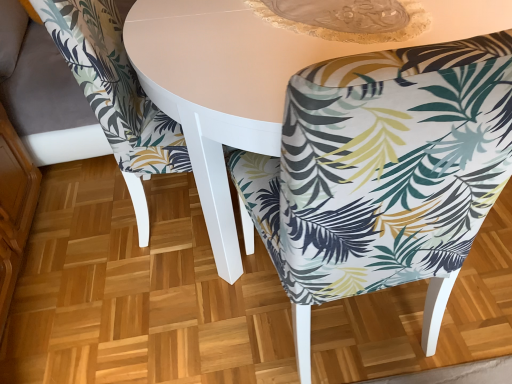
Where is `printed fabric chair at center, placed as the first chair when sorted from right to left`? printed fabric chair at center, placed as the first chair when sorted from right to left is located at coordinates (383, 167).

This screenshot has width=512, height=384. What are the coordinates of `printed fabric chair at center, arranged as the 1th chair when viewed from the left` in the screenshot? It's located at (116, 94).

Looking at this image, considering the relative sizes of printed fabric chair at center, which ranks as the 2th chair in left-to-right order, and white glossy table at center in the image provided, is printed fabric chair at center, which ranks as the 2th chair in left-to-right order, taller than white glossy table at center?

Yes, printed fabric chair at center, which ranks as the 2th chair in left-to-right order, is taller than white glossy table at center.

Is the depth of printed fabric chair at center, placed as the first chair when sorted from right to left, greater than that of white glossy table at center?

No, it is in front of white glossy table at center.

Between printed fabric chair at center, which ranks as the 2th chair in left-to-right order, and white glossy table at center, which one appears on the right side from the viewer's perspective?

printed fabric chair at center, which ranks as the 2th chair in left-to-right order, is more to the right.

Is point (445, 211) behind point (165, 3)?

No.

Looking at this image, are printed fabric chair at center, which ranks as the 2th chair in left-to-right order, and printed fabric chair at center, marked as the second chair in a right-to-left arrangement, located far from each other?

That's not correct — printed fabric chair at center, which ranks as the 2th chair in left-to-right order, is a little close to printed fabric chair at center, marked as the second chair in a right-to-left arrangement.

Between printed fabric chair at center, placed as the first chair when sorted from right to left, and printed fabric chair at center, marked as the second chair in a right-to-left arrangement, which one appears on the left side from the viewer's perspective?

From the viewer's perspective, printed fabric chair at center, marked as the second chair in a right-to-left arrangement, appears more on the left side.

Is printed fabric chair at center, marked as the second chair in a right-to-left arrangement, inside printed fabric chair at center, placed as the first chair when sorted from right to left?

No, printed fabric chair at center, placed as the first chair when sorted from right to left, does not contain printed fabric chair at center, marked as the second chair in a right-to-left arrangement.

From a real-world perspective, is white glossy table at center on printed fabric chair at center, marked as the second chair in a right-to-left arrangement?

No, from a real-world perspective, white glossy table at center is not over printed fabric chair at center, marked as the second chair in a right-to-left arrangement

Which is closer, (226, 101) or (114, 77)?

The point (226, 101) is closer.

Which is behind, white glossy table at center or printed fabric chair at center, arranged as the 1th chair when viewed from the left?

printed fabric chair at center, arranged as the 1th chair when viewed from the left, is behind.

From the image's perspective, would you say white glossy table at center is positioned over printed fabric chair at center, arranged as the 1th chair when viewed from the left?

No.

Can you confirm if printed fabric chair at center, arranged as the 1th chair when viewed from the left, is smaller than printed fabric chair at center, which ranks as the 2th chair in left-to-right order?

Actually, printed fabric chair at center, arranged as the 1th chair when viewed from the left, might be larger than printed fabric chair at center, which ranks as the 2th chair in left-to-right order.

Which of these two, printed fabric chair at center, marked as the second chair in a right-to-left arrangement, or printed fabric chair at center, which ranks as the 2th chair in left-to-right order, stands shorter?

Standing shorter between the two is printed fabric chair at center, marked as the second chair in a right-to-left arrangement.

Would you say printed fabric chair at center, placed as the first chair when sorted from right to left, is part of printed fabric chair at center, arranged as the 1th chair when viewed from the left,'s contents?

No, printed fabric chair at center, arranged as the 1th chair when viewed from the left, does not contain printed fabric chair at center, placed as the first chair when sorted from right to left.

Considering the relative sizes of printed fabric chair at center, marked as the second chair in a right-to-left arrangement, and printed fabric chair at center, placed as the first chair when sorted from right to left, in the image provided, is printed fabric chair at center, marked as the second chair in a right-to-left arrangement, wider than printed fabric chair at center, placed as the first chair when sorted from right to left,?

Indeed, printed fabric chair at center, marked as the second chair in a right-to-left arrangement, has a greater width compared to printed fabric chair at center, placed as the first chair when sorted from right to left.

Is white glossy table at center facing towards printed fabric chair at center, which ranks as the 2th chair in left-to-right order?

Yes, white glossy table at center is facing printed fabric chair at center, which ranks as the 2th chair in left-to-right order.

From their relative heights in the image, would you say white glossy table at center is taller or shorter than printed fabric chair at center, placed as the first chair when sorted from right to left?

white glossy table at center is shorter than printed fabric chair at center, placed as the first chair when sorted from right to left.

Is printed fabric chair at center, marked as the second chair in a right-to-left arrangement, touching white glossy table at center?

printed fabric chair at center, marked as the second chair in a right-to-left arrangement, is not next to white glossy table at center, and they're not touching.

Which object is closer to the camera taking this photo, printed fabric chair at center, arranged as the 1th chair when viewed from the left, or white glossy table at center?

white glossy table at center is in front.

The image size is (512, 384). In order to click on round table that is on the right side of printed fabric chair at center, arranged as the 1th chair when viewed from the left in this screenshot , I will do `click(232, 86)`.

Locate an element on the screen. round table that is under the printed fabric chair at center, placed as the first chair when sorted from right to left (from a real-world perspective) is located at coordinates (232, 86).

At what (x,y) coordinates should I click in order to perform the action: click on chair located above the printed fabric chair at center, arranged as the 1th chair when viewed from the left (from a real-world perspective). Please return your answer as a coordinate pair (x, y). This screenshot has width=512, height=384. Looking at the image, I should click on point(383,167).

Based on the photo, considering their positions, is printed fabric chair at center, marked as the second chair in a right-to-left arrangement, positioned further to white glossy table at center than printed fabric chair at center, placed as the first chair when sorted from right to left?

printed fabric chair at center, placed as the first chair when sorted from right to left, is further to white glossy table at center.

From the picture: When comparing their distances from white glossy table at center, does printed fabric chair at center, placed as the first chair when sorted from right to left, or printed fabric chair at center, arranged as the 1th chair when viewed from the left, seem closer?

printed fabric chair at center, arranged as the 1th chair when viewed from the left.

Which object lies further to the anchor point printed fabric chair at center, which ranks as the 2th chair in left-to-right order, printed fabric chair at center, arranged as the 1th chair when viewed from the left, or white glossy table at center?

Among the two, printed fabric chair at center, arranged as the 1th chair when viewed from the left, is located further to printed fabric chair at center, which ranks as the 2th chair in left-to-right order.

Estimate the real-world distances between objects in this image. Which object is closer to printed fabric chair at center, placed as the first chair when sorted from right to left, white glossy table at center or printed fabric chair at center, arranged as the 1th chair when viewed from the left?

white glossy table at center.

Estimate the real-world distances between objects in this image. Which object is closer to printed fabric chair at center, marked as the second chair in a right-to-left arrangement, printed fabric chair at center, which ranks as the 2th chair in left-to-right order, or white glossy table at center?

Among the two, white glossy table at center is located nearer to printed fabric chair at center, marked as the second chair in a right-to-left arrangement.

Considering their positions, is white glossy table at center positioned further to printed fabric chair at center, arranged as the 1th chair when viewed from the left, than printed fabric chair at center, which ranks as the 2th chair in left-to-right order?

Among the two, printed fabric chair at center, which ranks as the 2th chair in left-to-right order, is located further to printed fabric chair at center, arranged as the 1th chair when viewed from the left.

Find the location of a particular element. round table situated between printed fabric chair at center, marked as the second chair in a right-to-left arrangement, and printed fabric chair at center, which ranks as the 2th chair in left-to-right order, from left to right is located at coordinates (232, 86).